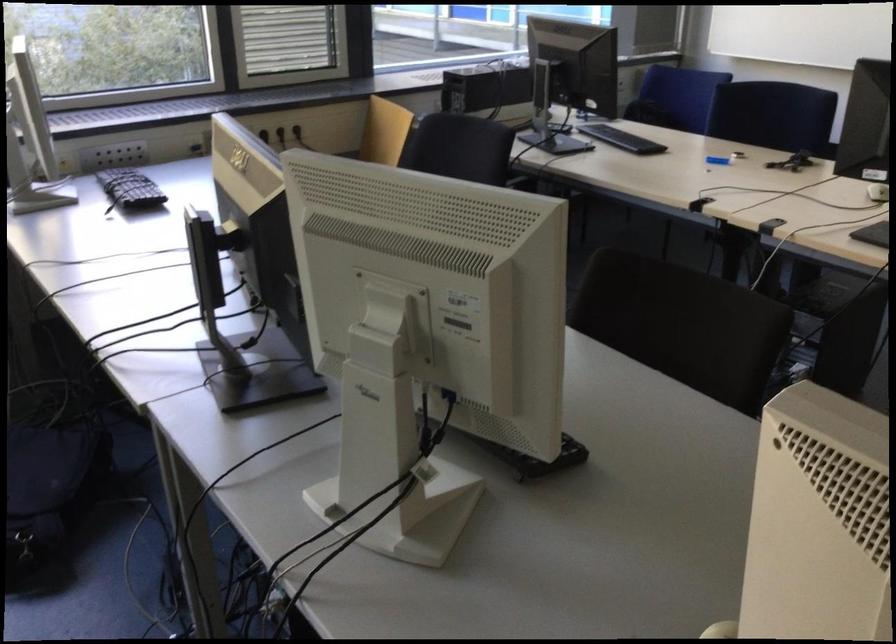
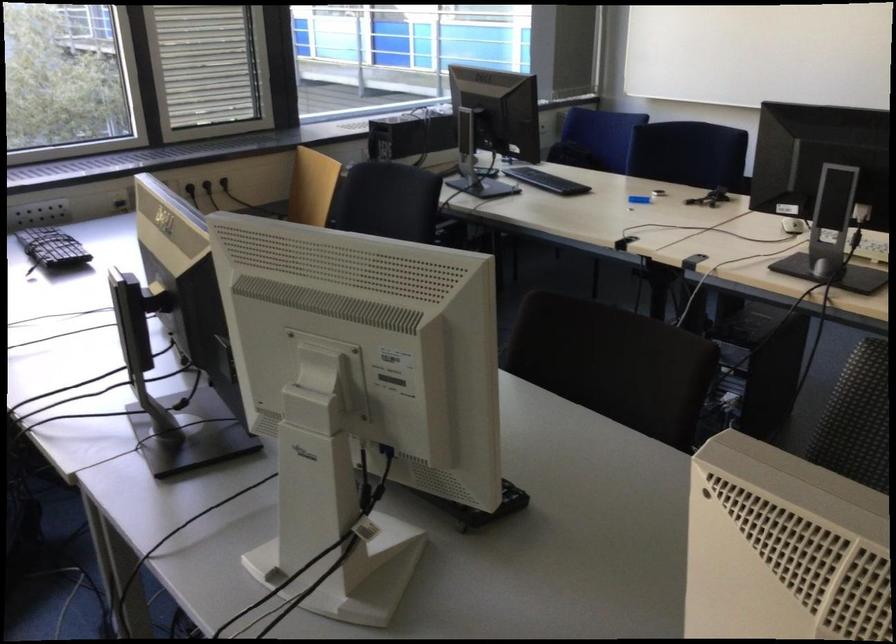
Question: The first image is from the beginning of the video and the second image is from the end. How did the camera likely rotate when shooting the video?

Choices:
 (A) Left
 (B) Right
 (C) Up
 (D) Down

Answer: (B)